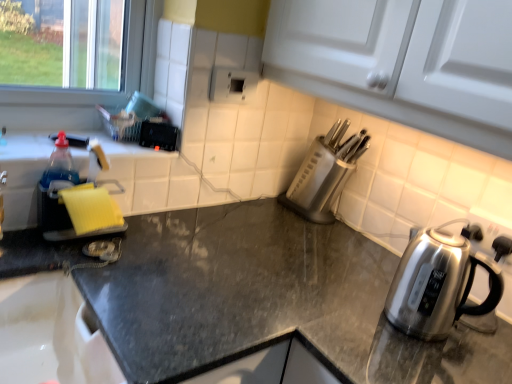
In the scene shown: Measure the distance between point [99,161] and camera.

The distance of point [99,161] from camera is 3.67 feet.

Locate an element on the screen. Image resolution: width=512 pixels, height=384 pixels. yellow sponge at left is located at coordinates (75, 196).

Is yellow sponge at left positioned with its back to black granite countertop at center?

No, black granite countertop at center is not at the back of yellow sponge at left.

Does point (97, 174) come closer to viewer compared to point (420, 364)?

No.

Which object is positioned more to the left, yellow sponge at left or black granite countertop at center?

yellow sponge at left.

Would you say yellow sponge at left contains black granite countertop at center?

Definitely not — black granite countertop at center is not inside yellow sponge at left.

Which is in front, point (310, 177) or point (499, 250)?

Point (499, 250)

Based on the photo, would you consider satin silver knife block at center-right to be distant from satin silver kettle at right?

No, there isn't a large distance between satin silver knife block at center-right and satin silver kettle at right.

Considering the sizes of satin silver knife block at center-right and satin silver kettle at right in the image, is satin silver knife block at center-right wider or thinner than satin silver kettle at right?

satin silver knife block at center-right is thinner than satin silver kettle at right.

Considering the sizes of satin silver knife block at center-right and satin silver kettle at right in the image, is satin silver knife block at center-right bigger or smaller than satin silver kettle at right?

Clearly, satin silver knife block at center-right is smaller in size than satin silver kettle at right.

Locate an element on the screen. The width and height of the screenshot is (512, 384). sink that appears on the left of satin silver kettle at right is located at coordinates (75, 196).

Is satin silver kettle at right at the left side of yellow sponge at left?

No, satin silver kettle at right is not to the left of yellow sponge at left.

Considering the positions of objects satin silver kettle at right and yellow sponge at left in the image provided, who is behind, satin silver kettle at right or yellow sponge at left?

yellow sponge at left is further away from the camera.

From the picture: How different are the orientations of satin silver kettle at right and yellow sponge at left in degrees?

satin silver kettle at right and yellow sponge at left are facing 90.4 degrees away from each other.

Which is more to the left, satin silver kettle at right or black granite countertop at center?

From the viewer's perspective, black granite countertop at center appears more on the left side.

There is a black granite countertop at center. At what (x,y) coordinates should I click in order to perform the action: click on kettle above it (from a real-world perspective). Please return your answer as a coordinate pair (x, y). Looking at the image, I should click on (441, 280).

Can you confirm if satin silver kettle at right is thinner than black granite countertop at center?

Indeed, satin silver kettle at right has a lesser width compared to black granite countertop at center.

Could you tell me if satin silver kettle at right is turned towards black granite countertop at center?

No, satin silver kettle at right is not oriented towards black granite countertop at center.

Which is farther, (x=472, y=265) or (x=330, y=144)?

Point (x=330, y=144)

Considering the relative sizes of satin silver kettle at right and satin silver knife block at center-right in the image provided, is satin silver kettle at right shorter than satin silver knife block at center-right?

Yes.

From the picture: Relative to satin silver knife block at center-right, is satin silver kettle at right in front or behind?

satin silver kettle at right is positioned closer to the viewer than satin silver knife block at center-right.

Is black granite countertop at center to the left of yellow sponge at left from the viewer's perspective?

In fact, black granite countertop at center is to the right of yellow sponge at left.

Is black granite countertop at center positioned far away from yellow sponge at left?

No, black granite countertop at center is not far from yellow sponge at left.

From the image's perspective, relative to yellow sponge at left, is black granite countertop at center above or below?

black granite countertop at center is situated lower than yellow sponge at left in the image.

This screenshot has width=512, height=384. In order to click on sink above the black granite countertop at center (from the image's perspective) in this screenshot , I will do `click(75, 196)`.

Which is behind, point (68, 160) or point (344, 160)?

The point (344, 160) is farther.

Is there a large distance between yellow sponge at left and satin silver knife block at center-right?

No, yellow sponge at left is not far from satin silver knife block at center-right.

Find the location of a particular element. sink located above the black granite countertop at center (from the image's perspective) is located at coordinates (75, 196).

The width and height of the screenshot is (512, 384). Identify the location of appliance behind the satin silver kettle at right. point(324,173).

Based on their spatial positions, is satin silver knife block at center-right or yellow sponge at left closer to satin silver kettle at right?

The object closer to satin silver kettle at right is satin silver knife block at center-right.

When comparing their distances from black granite countertop at center, does satin silver kettle at right or satin silver knife block at center-right seem further?

The object further to black granite countertop at center is satin silver knife block at center-right.

Consider the image. Looking at the image, which one is located further to satin silver knife block at center-right, black granite countertop at center or yellow sponge at left?

yellow sponge at left is positioned further to the anchor satin silver knife block at center-right.

When comparing their distances from satin silver kettle at right, does black granite countertop at center or yellow sponge at left seem closer?

The object closer to satin silver kettle at right is black granite countertop at center.

In the scene shown: Based on their spatial positions, is yellow sponge at left or black granite countertop at center further from satin silver knife block at center-right?

Based on the image, yellow sponge at left appears to be further to satin silver knife block at center-right.

Looking at the image, which one is located further to satin silver knife block at center-right, yellow sponge at left or satin silver kettle at right?

Based on the image, yellow sponge at left appears to be further to satin silver knife block at center-right.

Based on their spatial positions, is yellow sponge at left or black granite countertop at center further from satin silver kettle at right?

The object further to satin silver kettle at right is yellow sponge at left.

When comparing their distances from satin silver knife block at center-right, does satin silver kettle at right or black granite countertop at center seem further?

black granite countertop at center is positioned further to the anchor satin silver knife block at center-right.

Where is `kettle between satin silver knife block at center-right and black granite countertop at center in the up-down direction`? This screenshot has width=512, height=384. kettle between satin silver knife block at center-right and black granite countertop at center in the up-down direction is located at coordinates coord(441,280).

Identify the location of countertop situated between yellow sponge at left and satin silver kettle at right from left to right. (266, 299).

Identify the location of sink that lies between satin silver knife block at center-right and black granite countertop at center from top to bottom. This screenshot has width=512, height=384. (75, 196).

The height and width of the screenshot is (384, 512). I want to click on appliance between yellow sponge at left and satin silver kettle at right in the horizontal direction, so click(x=324, y=173).